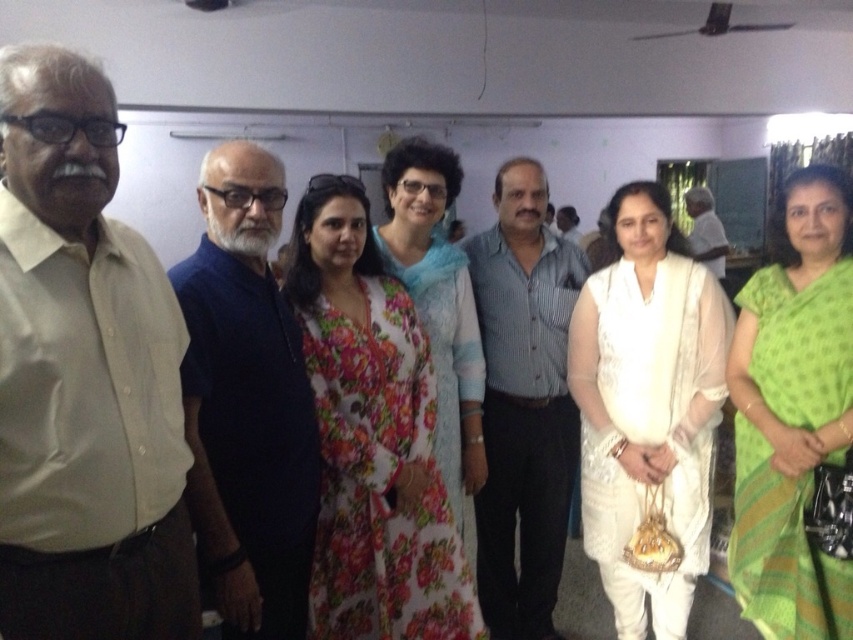
You are standing at the entrance of the room and want to hand a gift to the person wearing the dark blue shirt at center and the white cotton shirt at center. Which one is closer to you?

The dark blue shirt at center is 6.03 meters away from the white cotton shirt at center. However, without knowing your exact position, it is impossible to determine which is closer. Please provide more information about your location relative to the shirts.

You are standing in the room and want to reach the point marked at coordinates (310, 396). Considering your height is 1.7 meters, can you comfortably reach that point without standing on anything?

The point at coordinates (310, 396) is 1.77 meters from the viewer. Since your height is 1.7 meters, you can comfortably reach it without needing to stand on anything as the point is slightly above your height.

You are a photographer at the event and want to capture a photo that includes both the dark blue shirt at center and the white silk saree at center. Which one should you focus on first to ensure both are in the frame?

The dark blue shirt at center is in front of the white silk saree at center, so focus on the dark blue shirt at center first to ensure both are visible in the frame.